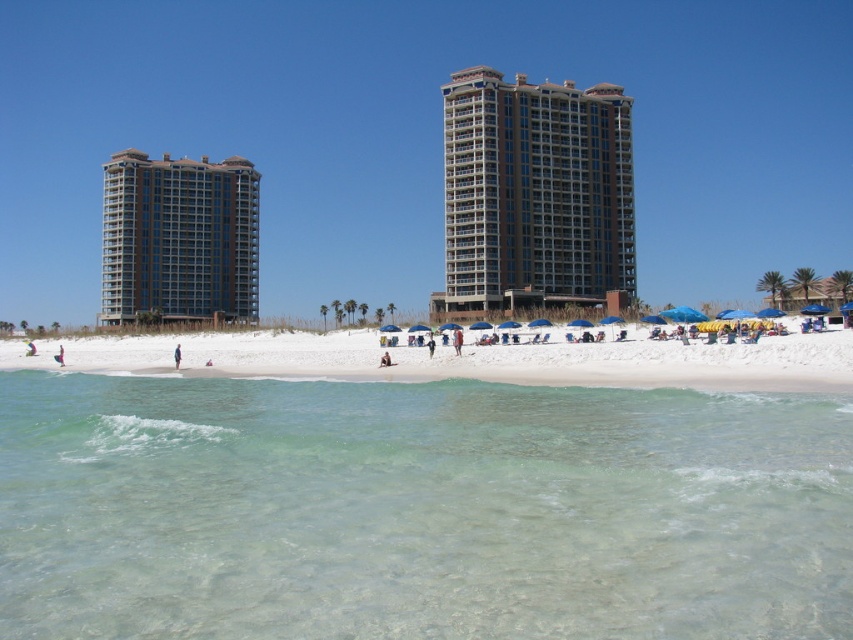
You are a photographer wanting to capture the white sandy beach at center and the gray concrete building at left in the same frame. Which object should you position closer to the front of your camera to ensure both are visible?

The gray concrete building at left is taller than the white sandy beach at center. To ensure both are visible in the same frame, position the camera closer to the front of the gray concrete building at left so its height doesn